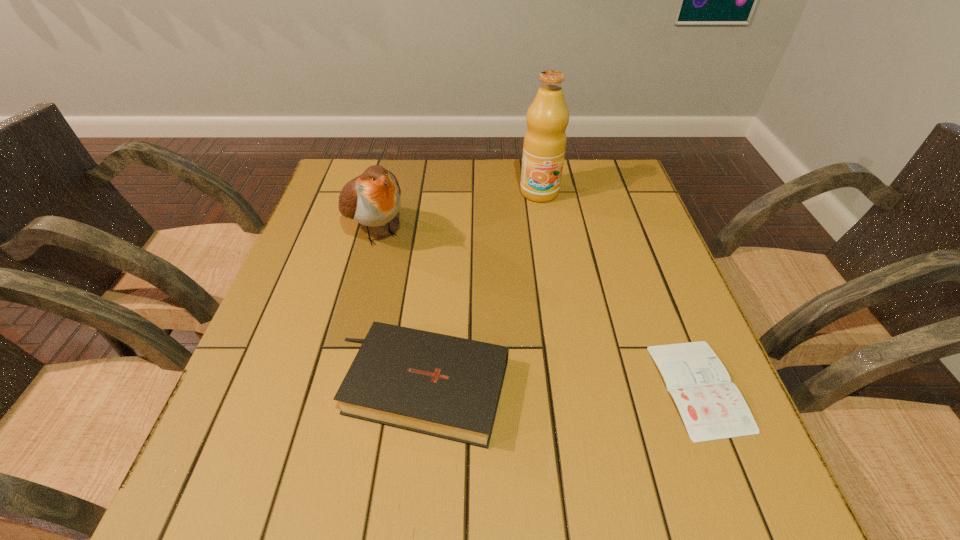
Locate an element on the screen. empty space that is in between the tallest object and the Bible is located at coordinates (480, 290).

Where is `unoccupied position between the rightmost object and the fruit juice`? unoccupied position between the rightmost object and the fruit juice is located at coordinates (619, 290).

Identify the location of empty space that is in between the Bible and the diary. Image resolution: width=960 pixels, height=540 pixels. (560, 387).

The width and height of the screenshot is (960, 540). Find the location of `free space between the third nearest object and the second shortest object`. free space between the third nearest object and the second shortest object is located at coordinates (397, 309).

Where is `unoccupied position between the second tallest object and the second shortest object`? The width and height of the screenshot is (960, 540). unoccupied position between the second tallest object and the second shortest object is located at coordinates (397, 309).

Where is `vacant space in between the bird and the Bible`? vacant space in between the bird and the Bible is located at coordinates (397, 309).

Locate an element on the screen. The image size is (960, 540). vacant point located between the second farthest object and the shortest object is located at coordinates (537, 309).

Identify which object is the third nearest to the second object from right to left. Please provide its 2D coordinates. Your answer should be formatted as a tuple, i.e. [(x, y)], where the tuple contains the x and y coordinates of a point satisfying the conditions above.

[(712, 408)]

Identify the location of the second closest object to the third shortest object. (544, 146).

At what (x,y) coordinates should I click in order to perform the action: click on vacant space that satisfies the following two spatial constraints: 1. on the front side of the diary; 2. on the left side of the third nearest object. Please return your answer as a coordinate pair (x, y). This screenshot has width=960, height=540. Looking at the image, I should click on (332, 387).